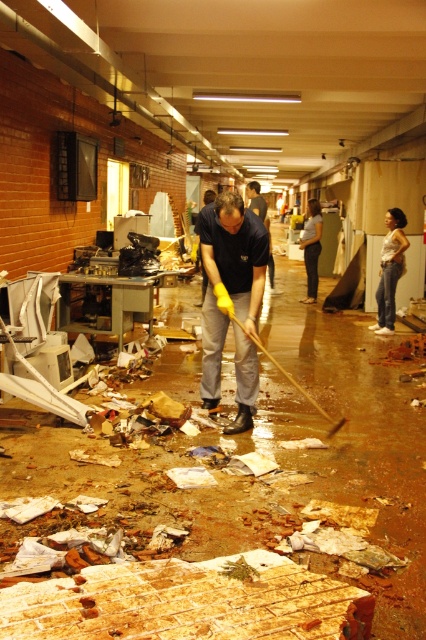
Question: Which point is closer to the camera?

Choices:
 (A) (314, 228)
 (B) (382, 307)

Answer: (B)

Question: Which point appears closest to the camera in this image?

Choices:
 (A) (336, 422)
 (B) (259, 307)
 (C) (319, 218)
 (D) (389, 330)

Answer: (A)

Question: Can you confirm if matte blue shirt at center is positioned above white cotton shirt at center?

Choices:
 (A) yes
 (B) no

Answer: (B)

Question: Can you confirm if matte blue shirt at center is wider than white cotton shirt at center?

Choices:
 (A) yes
 (B) no

Answer: (A)

Question: Considering the real-world distances, which object is closest to the yellow rubber shovel at center?

Choices:
 (A) white cotton shirt at center
 (B) light brown hair at center

Answer: (A)

Question: Can you confirm if white cotton shirt at center is smaller than light brown hair at center?

Choices:
 (A) yes
 (B) no

Answer: (B)